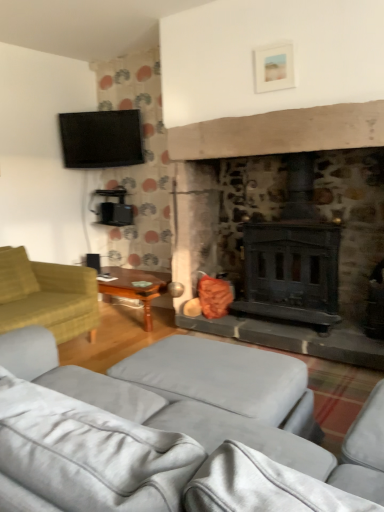
Question: Is point (130, 120) positioned closer to the camera than point (16, 321)?

Choices:
 (A) closer
 (B) farther

Answer: (B)

Question: Is matte black tv at upper left bigger or smaller than green fabric studio couch at left, placed as the second studio couch when sorted from front to back?

Choices:
 (A) big
 (B) small

Answer: (B)

Question: Based on their relative distances, which object is farther from the matte black tv at upper left?

Choices:
 (A) light gray fabric studio couch at lower center, arranged as the 2th studio couch when viewed from the back
 (B) green fabric studio couch at left, placed as the second studio couch when sorted from front to back
 (C) wooden polished table at left
 (D) soft yellow pillow at left
 (E) matte white picture frame at upper center

Answer: (A)

Question: Which object is the farthest from the matte black tv at upper left?

Choices:
 (A) green fabric studio couch at left, placed as the second studio couch when sorted from front to back
 (B) matte white picture frame at upper center
 (C) wooden polished table at left
 (D) soft yellow pillow at left
 (E) light gray fabric studio couch at lower center, the first studio couch when ordered from front to back

Answer: (E)